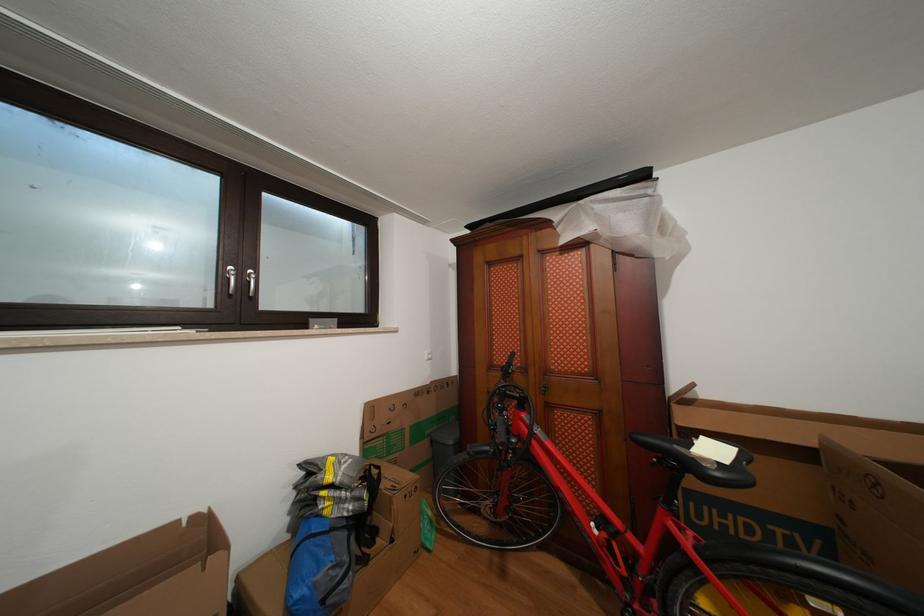
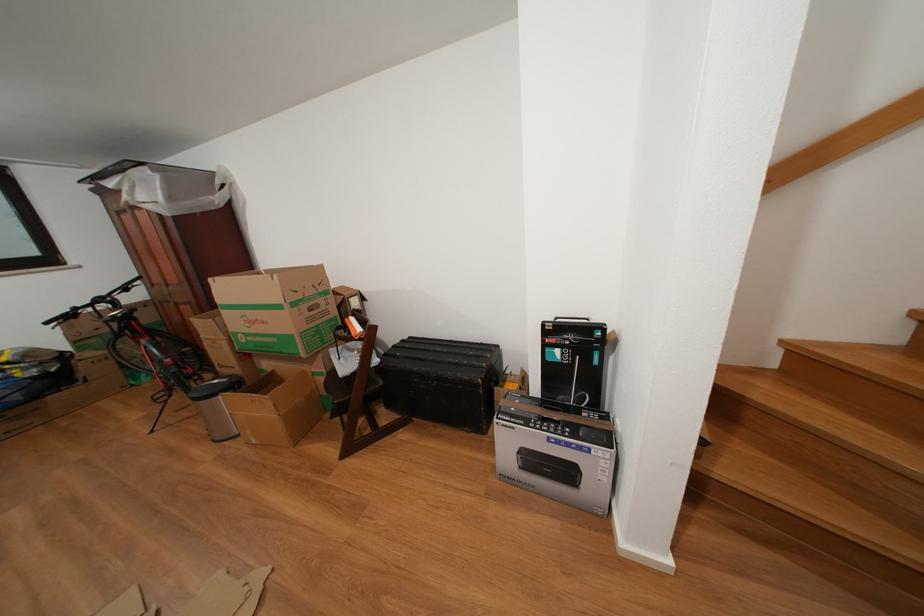
The images are taken continuously from a first-person perspective. In which direction are you moving?

The movement direction of the cameraman is right, backward.